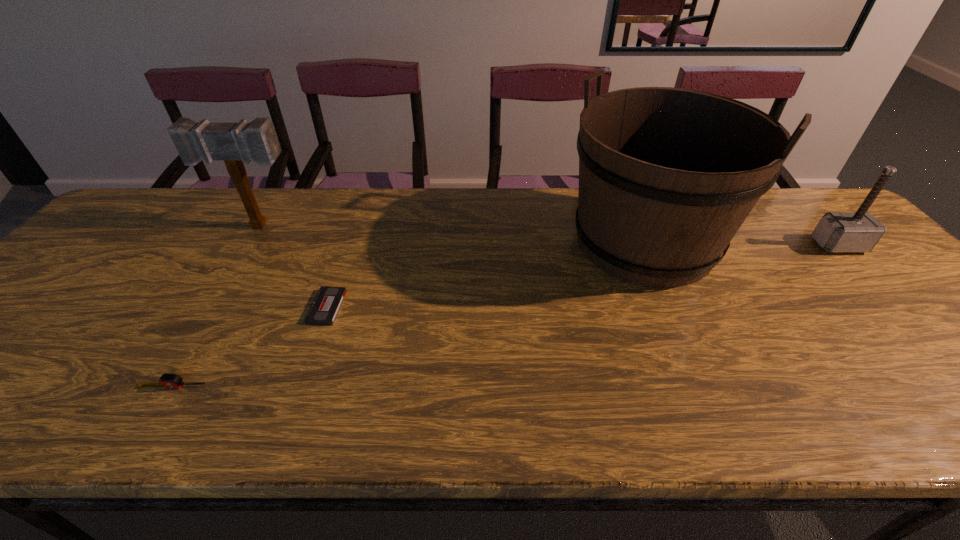
Identify the location of unoccupied area between the mallet and the third object from right to left. This screenshot has width=960, height=540. (294, 267).

You are a GUI agent. You are given a task and a screenshot of the screen. Output one action in this format:
    pyautogui.click(x=<x>, y=<y>)
    Task: Click on the vacant space that's between the fourth shortest object and the videotape
    This screenshot has height=540, width=960.
    Given the screenshot: What is the action you would take?
    pyautogui.click(x=294, y=267)

Where is `vacant point located between the third object from left to right and the bucket`? The width and height of the screenshot is (960, 540). vacant point located between the third object from left to right and the bucket is located at coordinates (486, 275).

This screenshot has width=960, height=540. I want to click on free area in between the hammer and the second object from right to left, so click(741, 244).

The image size is (960, 540). I want to click on vacant point located between the shortest object and the hammer, so click(583, 276).

Where is `free spot between the shortest object and the second object from right to left`? free spot between the shortest object and the second object from right to left is located at coordinates (486, 275).

Find the location of a particular element. This screenshot has height=540, width=960. empty space between the second object from right to left and the rightmost object is located at coordinates (741, 244).

This screenshot has width=960, height=540. In order to click on empty location between the shortest object and the second shortest object in this screenshot , I will do `click(250, 347)`.

Image resolution: width=960 pixels, height=540 pixels. I want to click on vacant area between the fourth shortest object and the tallest object, so point(453,234).

Identify which object is the second nearest to the second object from right to left. Please provide its 2D coordinates. Your answer should be formatted as a tuple, i.e. [(x, y)], where the tuple contains the x and y coordinates of a point satisfying the conditions above.

[(328, 300)]